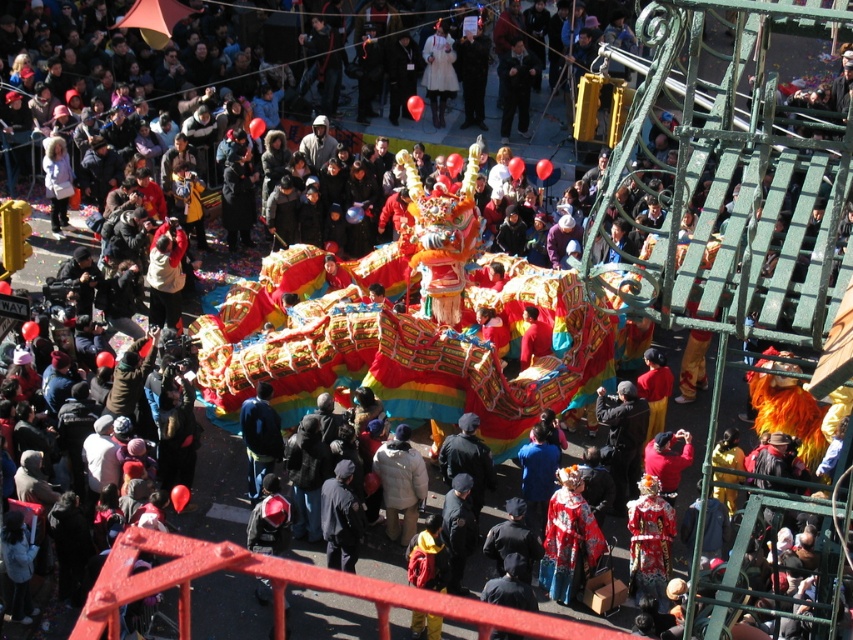
Is red satin costume at center positioned at the back of embroidered silk costume at center?

Yes, it is behind embroidered silk costume at center.

Describe the element at coordinates (569, 538) in the screenshot. This screenshot has height=640, width=853. I see `red satin costume at center` at that location.

This screenshot has height=640, width=853. Identify the location of red satin costume at center. (569, 538).

Is embroidered silk costume at center smaller than dark gray fabric jacket at center?

No.

Is point (636, 500) closer to camera compared to point (337, 515)?

No, it is not.

Is point (664, 547) in front of point (323, 508)?

That is True.

Locate an element on the screen. Image resolution: width=853 pixels, height=640 pixels. embroidered silk costume at center is located at coordinates (650, 541).

Between embroidered silk costume at center and white puffy coat at center, which one is positioned higher?

white puffy coat at center is above.

Which is more to the right, embroidered silk costume at center or white puffy coat at center?

From the viewer's perspective, embroidered silk costume at center appears more on the right side.

Which is in front, point (642, 540) or point (386, 488)?

Positioned in front is point (642, 540).

The width and height of the screenshot is (853, 640). I want to click on embroidered silk costume at center, so click(x=650, y=541).